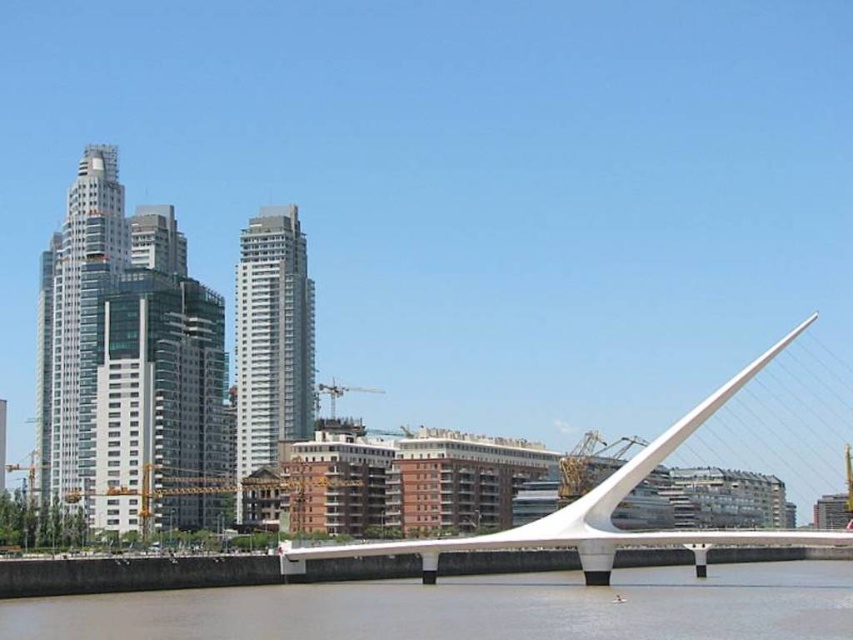
Does point (396, 582) lie behind point (286, 563)?

Yes, point (396, 582) is behind point (286, 563).

Describe the element at coordinates (469, 608) in the screenshot. I see `brown sedimentary water at lower center` at that location.

Is point (492, 616) positioned in front of point (610, 509)?

Yes, point (492, 616) is closer to viewer.

Where is `brown sedimentary water at lower center`? This screenshot has height=640, width=853. brown sedimentary water at lower center is located at coordinates (469, 608).